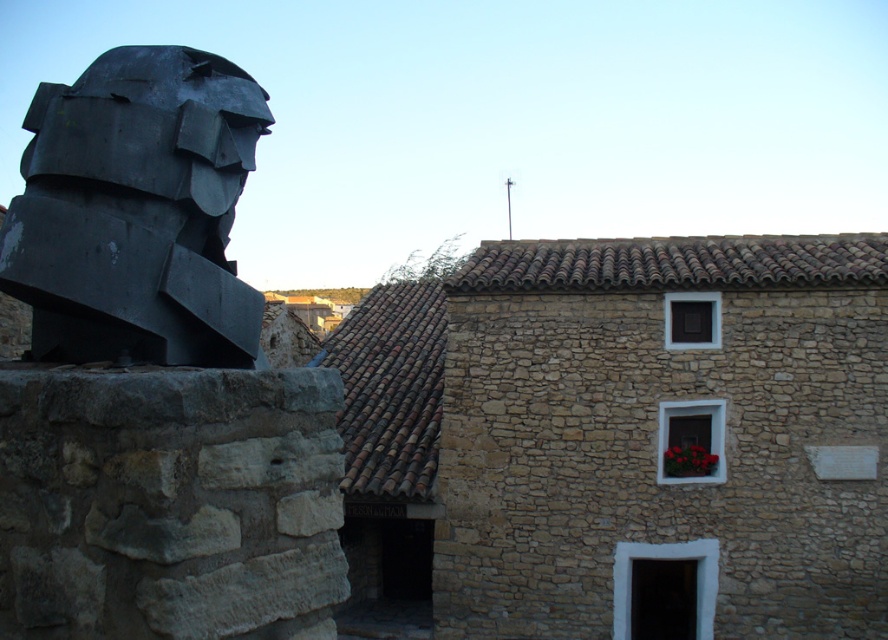
You are standing in front of the rustic stone building and want to place a new decorative item between the matte black sculpture at left and the red matte flower box at center. Based on their positions, which object should the new item be closer to?

The new decorative item should be placed closer to the matte black sculpture at left because it is nearer to the viewer compared to the red matte flower box at center.

You are standing at the point with coordinates point (108, 314) and want to walk to point (680, 467). According to the image, will you be moving towards the building or away from it?

Since point (108, 314) is in front of point (680, 467), moving from point (108, 314) to point (680, 467) means you are moving away from the building.